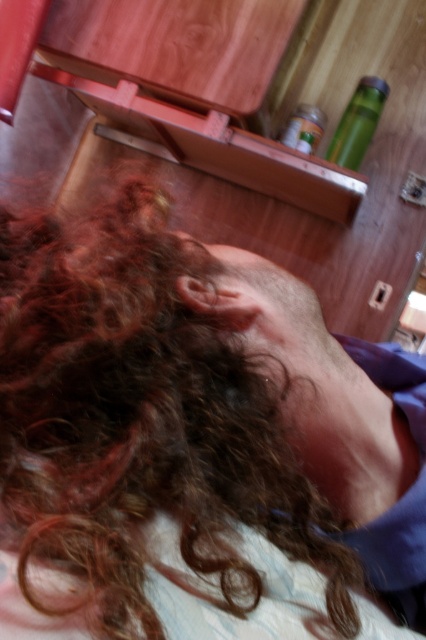
Question: From the image, what is the correct spatial relationship of curly brown hair at center in relation to green matte bottle at upper right?

Choices:
 (A) right
 (B) left

Answer: (B)

Question: Observing the image, what is the correct spatial positioning of curly brown hair at center in reference to green matte bottle at upper right?

Choices:
 (A) left
 (B) right

Answer: (A)

Question: Which of the following is the farthest from the observer?

Choices:
 (A) (359, 96)
 (B) (100, 426)

Answer: (A)

Question: Is curly brown hair at center bigger than green matte bottle at upper right?

Choices:
 (A) no
 (B) yes

Answer: (B)

Question: Which point is closer to the camera?

Choices:
 (A) curly brown hair at center
 (B) green matte bottle at upper right

Answer: (A)